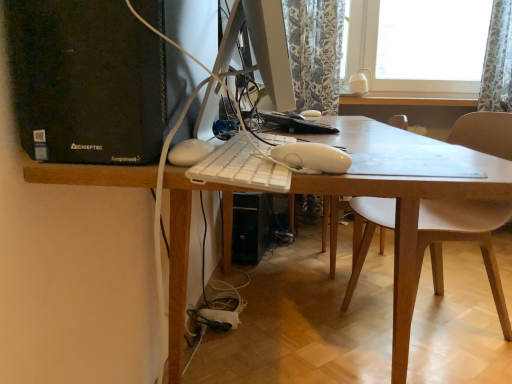
Question: From a real-world perspective, is white plastic keyboard at center on floral fabric curtain at upper right?

Choices:
 (A) no
 (B) yes

Answer: (A)

Question: Is the depth of white plastic keyboard at center less than that of floral fabric curtain at upper right?

Choices:
 (A) no
 (B) yes

Answer: (B)

Question: Is white plastic keyboard at center smaller than floral fabric curtain at upper right?

Choices:
 (A) yes
 (B) no

Answer: (A)

Question: From the image's perspective, is white plastic keyboard at center located above floral fabric curtain at upper right?

Choices:
 (A) no
 (B) yes

Answer: (A)

Question: Could you tell me if white plastic keyboard at center is turned towards floral fabric curtain at upper right?

Choices:
 (A) yes
 (B) no

Answer: (B)

Question: Is white plastic keyboard at center not inside floral fabric curtain at upper right?

Choices:
 (A) no
 (B) yes

Answer: (B)

Question: Is black plastic computer tower at left positioned behind white plastic desk at center?

Choices:
 (A) yes
 (B) no

Answer: (A)

Question: Does black plastic computer tower at left have a greater height compared to white plastic desk at center?

Choices:
 (A) yes
 (B) no

Answer: (B)

Question: From the image's perspective, is black plastic computer tower at left below white plastic desk at center?

Choices:
 (A) no
 (B) yes

Answer: (A)

Question: Considering the relative sizes of black plastic computer tower at left and white plastic desk at center in the image provided, is black plastic computer tower at left wider than white plastic desk at center?

Choices:
 (A) yes
 (B) no

Answer: (B)

Question: Are black plastic computer tower at left and white plastic desk at center far apart?

Choices:
 (A) no
 (B) yes

Answer: (A)

Question: Can you confirm if black plastic computer tower at left is shorter than white plastic desk at center?

Choices:
 (A) no
 (B) yes

Answer: (B)

Question: Is white plastic keyboard at center turned away from white plastic desk at center?

Choices:
 (A) no
 (B) yes

Answer: (A)